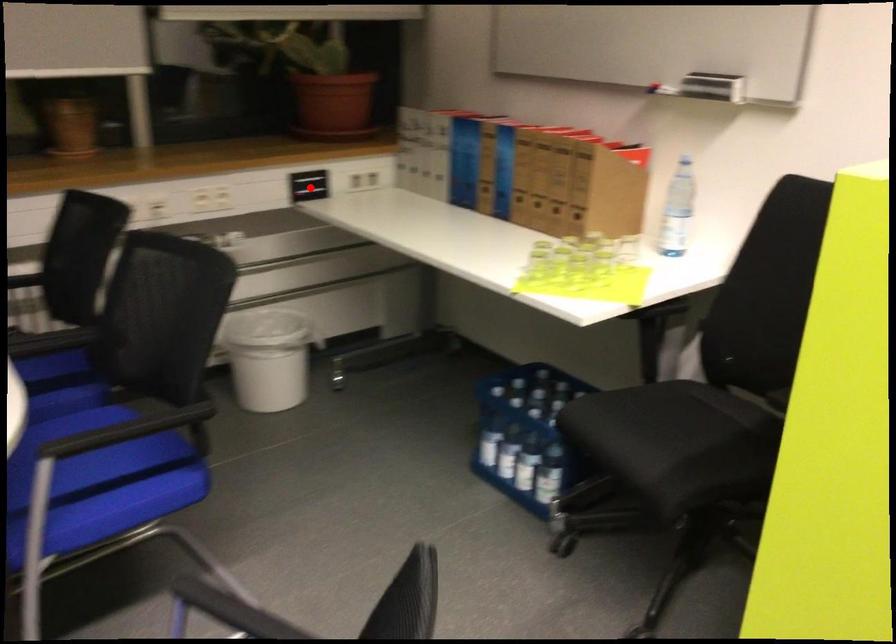
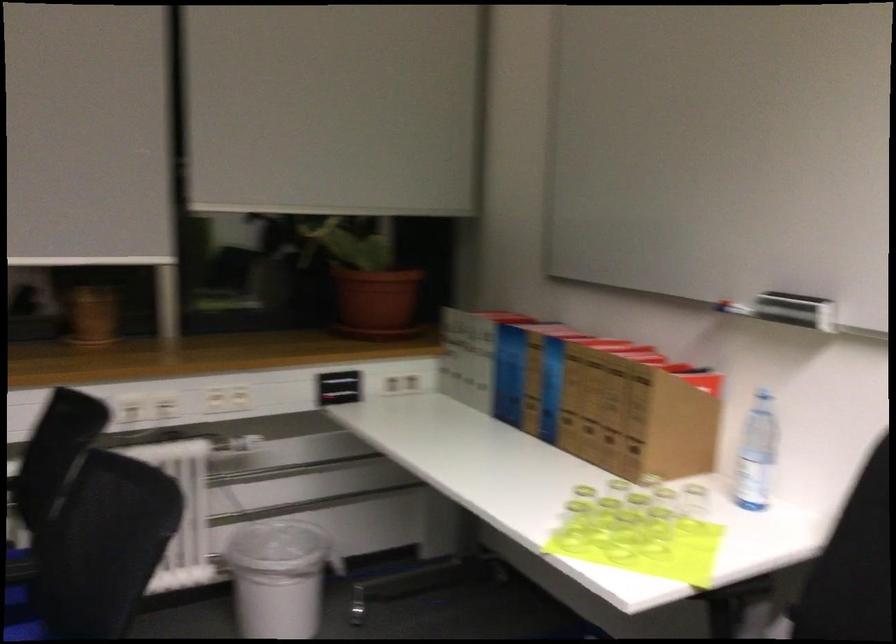
Question: I am providing you with two images of the same scene from different viewpoints. A red point is marked on the first image. Can you still see the location of the red point in image 2?

Choices:
 (A) Yes
 (B) No

Answer: (A)